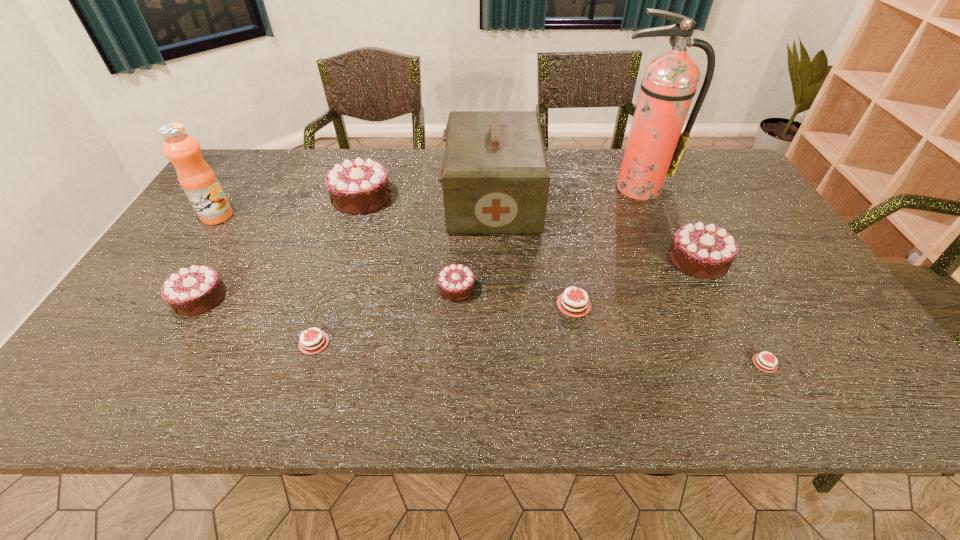
Identify the location of the tallest object. The image size is (960, 540). (658, 376).

Locate an element on the screen. fruit juice is located at coordinates (658, 376).

Locate an element on the screen. Image resolution: width=960 pixels, height=540 pixels. the first-aid kit is located at coordinates (658, 376).

The image size is (960, 540). I want to click on red first-aid kit, so click(658, 376).

This screenshot has width=960, height=540. Identify the location of the farthest chocolate chocolate cake. (658, 376).

Identify the location of the farthest chocolate cake. The width and height of the screenshot is (960, 540). (658, 376).

The height and width of the screenshot is (540, 960). What are the coordinates of `the sixth shortest object` in the screenshot? It's located at (739, 254).

The height and width of the screenshot is (540, 960). I want to click on the second tallest chocolate cake, so click(x=739, y=254).

Identify the location of the leftmost chocolate cake. 170,346.

Where is `the third biggest chocolate chocolate cake`? Image resolution: width=960 pixels, height=540 pixels. the third biggest chocolate chocolate cake is located at coordinates tap(170, 346).